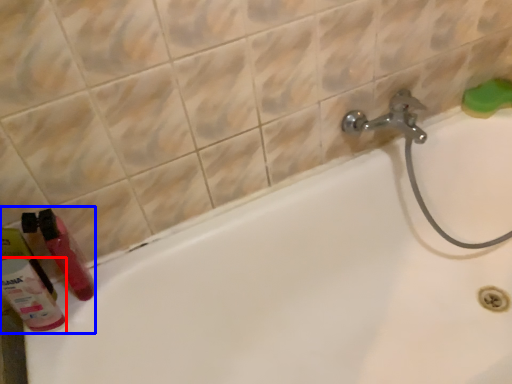
Question: Which point is closer to the camera, cleaning product (highlighted by a red box) or toiletry (highlighted by a blue box)?

Choices:
 (A) cleaning product
 (B) toiletry

Answer: (A)